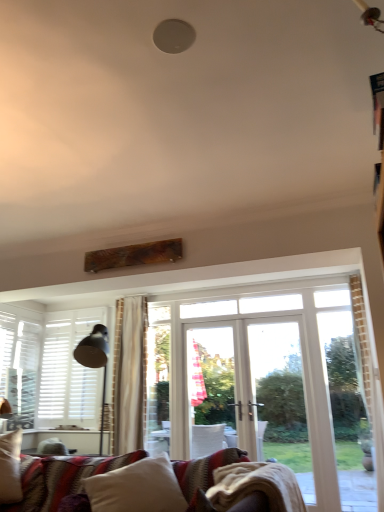
Question: Should I look upward or downward to see white matte shutters at left?

Choices:
 (A) up
 (B) down

Answer: (B)

Question: Does white soft pillow at lower center contain white matte shutters at left?

Choices:
 (A) yes
 (B) no

Answer: (B)

Question: Is white soft pillow at lower center at the right side of white matte shutters at left?

Choices:
 (A) no
 (B) yes

Answer: (B)

Question: Can you confirm if white soft pillow at lower center is positioned to the left of white matte shutters at left?

Choices:
 (A) no
 (B) yes

Answer: (A)

Question: Is white soft pillow at lower center shorter than white matte shutters at left?

Choices:
 (A) yes
 (B) no

Answer: (A)

Question: Can we say white soft pillow at lower center lies outside white matte shutters at left?

Choices:
 (A) yes
 (B) no

Answer: (A)

Question: Can you confirm if white soft pillow at lower center is bigger than white matte shutters at left?

Choices:
 (A) yes
 (B) no

Answer: (A)

Question: From the image's perspective, is white matte shutters at left located beneath white soft pillow at lower center?

Choices:
 (A) no
 (B) yes

Answer: (A)

Question: Considering the relative sizes of white matte shutters at left and white soft pillow at lower center in the image provided, is white matte shutters at left thinner than white soft pillow at lower center?

Choices:
 (A) yes
 (B) no

Answer: (A)

Question: Considering the relative sizes of white matte shutters at left and white soft pillow at lower center in the image provided, is white matte shutters at left bigger than white soft pillow at lower center?

Choices:
 (A) yes
 (B) no

Answer: (B)

Question: From the image's perspective, does white matte shutters at left appear higher than white soft pillow at lower center?

Choices:
 (A) yes
 (B) no

Answer: (A)

Question: Is white matte shutters at left shorter than white soft pillow at lower center?

Choices:
 (A) no
 (B) yes

Answer: (A)

Question: Does white matte shutters at left have a smaller size compared to white soft pillow at lower center?

Choices:
 (A) yes
 (B) no

Answer: (A)

Question: From the image's perspective, is white matte shutters at left positioned above or below white soft pillow at lower center?

Choices:
 (A) below
 (B) above

Answer: (B)